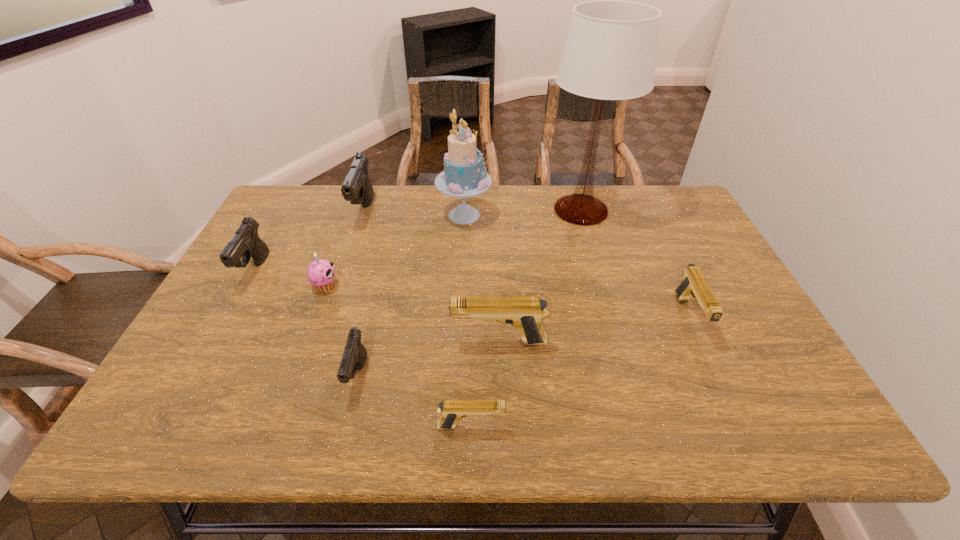
The width and height of the screenshot is (960, 540). I want to click on the rightmost tan pistol, so click(x=693, y=285).

Locate an element on the screen. This screenshot has width=960, height=540. the rightmost pistol is located at coordinates (693, 285).

Identify the location of the fourth pistol from right to left. Image resolution: width=960 pixels, height=540 pixels. (354, 356).

You are a GUI agent. You are given a task and a screenshot of the screen. Output one action in this format:
    pyautogui.click(x=<x>, y=<y>)
    Task: Click on the sixth object from right to left
    
    Given the screenshot: What is the action you would take?
    pyautogui.click(x=354, y=356)

Where is `the shortest object`? The width and height of the screenshot is (960, 540). the shortest object is located at coordinates (451, 411).

Image resolution: width=960 pixels, height=540 pixels. I want to click on the smallest tan pistol, so click(x=451, y=411).

The width and height of the screenshot is (960, 540). In order to click on free region located 0.120m above the cylindrical shade of the tallest object in this screenshot , I will do `click(595, 260)`.

Identify the location of vacant area situated 0.350m with a ladder on the side of the cake. (600, 215).

You are a GUI agent. You are given a task and a screenshot of the screen. Output one action in this format:
    pyautogui.click(x=<x>, y=<y>)
    Task: Click on the vacant area situated at the barrel of the second black pistol from right to left
    This screenshot has width=960, height=540.
    Given the screenshot: What is the action you would take?
    pyautogui.click(x=348, y=258)

Locate an element on the screen. Image resolution: width=960 pixels, height=540 pixels. vacant space located at the barrel of the biggest tan pistol is located at coordinates (345, 342).